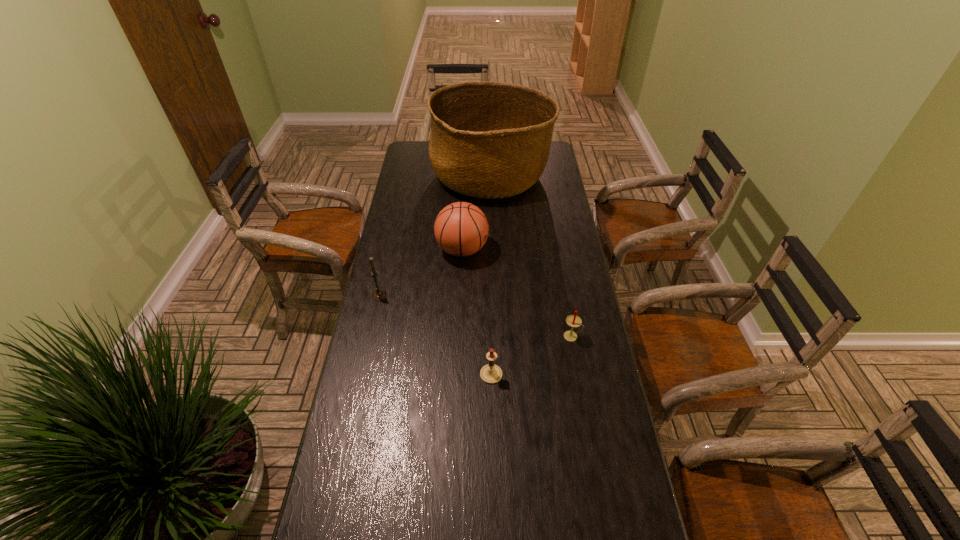
Find the location of `vacant space positioned on the surface of the second farthest object near the brand logo`. vacant space positioned on the surface of the second farthest object near the brand logo is located at coordinates (548, 250).

The height and width of the screenshot is (540, 960). Identify the location of free space located 0.050m on the back of the leftmost object. (383, 280).

Where is `vacant area situated on the left of the fourth farthest object`? The width and height of the screenshot is (960, 540). vacant area situated on the left of the fourth farthest object is located at coordinates (522, 336).

Identify the location of vacant region located on the back of the nearest object. The image size is (960, 540). (491, 323).

Where is `object that is at the far edge`? object that is at the far edge is located at coordinates (489, 140).

In order to click on basket located in the left edge section of the desktop in this screenshot , I will do `click(489, 140)`.

Find the location of a particular element. This screenshot has height=540, width=960. candle situated at the left edge is located at coordinates (379, 294).

Image resolution: width=960 pixels, height=540 pixels. What are the coordinates of `basket at the right edge` in the screenshot? It's located at (489, 140).

Locate an element on the screen. The image size is (960, 540). candle present at the right edge is located at coordinates tap(573, 321).

The height and width of the screenshot is (540, 960). Find the location of `object located at the far left corner`. object located at the far left corner is located at coordinates (489, 140).